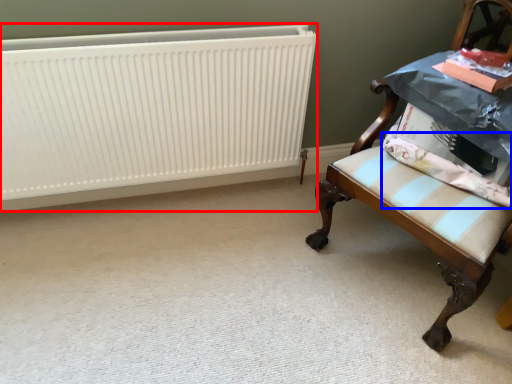
Question: Which object appears closest to the camera in this image, radiator (highlighted by a red box) or fabric (highlighted by a blue box)?

Choices:
 (A) radiator
 (B) fabric

Answer: (B)